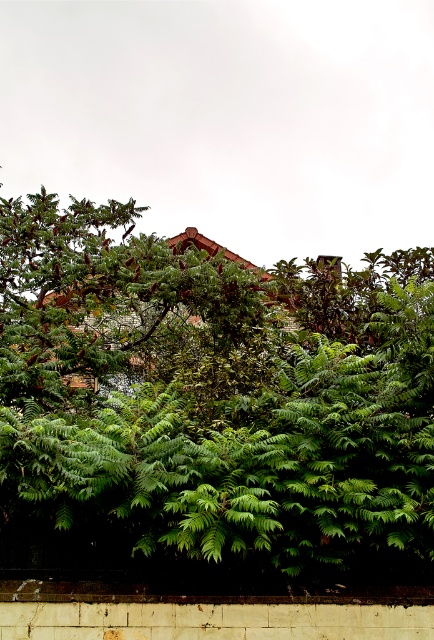
Question: Is green leafy tree at center thinner than smooth concrete ledge at bottom?

Choices:
 (A) no
 (B) yes

Answer: (A)

Question: Does green leafy tree at center appear on the right side of smooth concrete ledge at bottom?

Choices:
 (A) yes
 (B) no

Answer: (A)

Question: From the image, what is the correct spatial relationship of green leafy tree at center in relation to smooth concrete ledge at bottom?

Choices:
 (A) right
 (B) left

Answer: (A)

Question: Which object appears farthest from the camera in this image?

Choices:
 (A) smooth concrete ledge at bottom
 (B) green leafy tree at center

Answer: (A)

Question: Among these objects, which one is farthest from the camera?

Choices:
 (A) smooth concrete ledge at bottom
 (B) green leafy tree at center

Answer: (A)